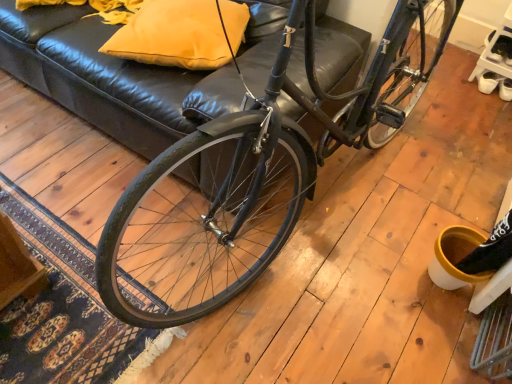
This screenshot has width=512, height=384. In order to click on matte yellow pillow at upper center in this screenshot , I will do `click(173, 35)`.

What do you see at coordinates (173, 35) in the screenshot?
I see `matte yellow pillow at upper center` at bounding box center [173, 35].

Measure the distance between point [129,39] and camera.

The distance of point [129,39] from camera is 1.48 meters.

What do you see at coordinates (251, 178) in the screenshot? The image size is (512, 384). I see `shiny black bicycle at center` at bounding box center [251, 178].

Consider the image. What is the approximate height of shiny black bicycle at center?

The height of shiny black bicycle at center is 1.17 meters.

The height and width of the screenshot is (384, 512). Identify the location of shiny black bicycle at center. click(x=251, y=178).

The height and width of the screenshot is (384, 512). I want to click on matte yellow pillow at upper center, so click(x=173, y=35).

In the scene shown: Which is more to the left, matte yellow pillow at upper center or shiny black bicycle at center?

Positioned to the left is matte yellow pillow at upper center.

Which object is further away from the camera taking this photo, matte yellow pillow at upper center or shiny black bicycle at center?

matte yellow pillow at upper center is more distant.

Between point (216, 64) and point (234, 279), which one is positioned behind?

Point (234, 279)

From the image's perspective, between matte yellow pillow at upper center and shiny black bicycle at center, which one is located above?

matte yellow pillow at upper center.

In the scene shown: From a real-world perspective, which is physically below, matte yellow pillow at upper center or shiny black bicycle at center?

matte yellow pillow at upper center.

Is matte yellow pillow at upper center wider or thinner than shiny black bicycle at center?

Considering their sizes, matte yellow pillow at upper center looks slimmer than shiny black bicycle at center.

Between matte yellow pillow at upper center and shiny black bicycle at center, which one has more height?

Standing taller between the two is shiny black bicycle at center.

Based on their sizes in the image, would you say matte yellow pillow at upper center is bigger or smaller than shiny black bicycle at center?

Clearly, matte yellow pillow at upper center is smaller in size than shiny black bicycle at center.

Choose the correct answer: Is matte yellow pillow at upper center inside shiny black bicycle at center or outside it?

The correct answer is: outside.

Is matte yellow pillow at upper center beside shiny black bicycle at center?

No, matte yellow pillow at upper center is not in contact with shiny black bicycle at center.

Is matte yellow pillow at upper center positioned with its back to shiny black bicycle at center?

No, shiny black bicycle at center is not at the back of matte yellow pillow at upper center.

Consider the image. Can you tell me how much matte yellow pillow at upper center and shiny black bicycle at center differ in facing direction?

There is a 32.4-degree angle between the facing directions of matte yellow pillow at upper center and shiny black bicycle at center.

This screenshot has height=384, width=512. What are the coordinates of `pillow that appears on the left of shiny black bicycle at center` in the screenshot? It's located at (173, 35).

Between shiny black bicycle at center and matte yellow pillow at upper center, which one appears on the left side from the viewer's perspective?

matte yellow pillow at upper center is more to the left.

From the picture: Considering the positions of objects shiny black bicycle at center and matte yellow pillow at upper center in the image provided, who is behind, shiny black bicycle at center or matte yellow pillow at upper center?

Positioned behind is matte yellow pillow at upper center.

Does point (381, 53) appear closer or farther from the camera than point (227, 29)?

Point (381, 53) appears to be farther away from the viewer than point (227, 29).

From the image's perspective, is shiny black bicycle at center over matte yellow pillow at upper center?

No, from the image's perspective, shiny black bicycle at center is not on top of matte yellow pillow at upper center.

From a real-world perspective, is shiny black bicycle at center positioned under matte yellow pillow at upper center based on gravity?

No, from a real-world perspective, shiny black bicycle at center is not under matte yellow pillow at upper center.

Looking at this image, is shiny black bicycle at center wider than matte yellow pillow at upper center?

Yes, shiny black bicycle at center is wider than matte yellow pillow at upper center.

Between shiny black bicycle at center and matte yellow pillow at upper center, which one has less height?

matte yellow pillow at upper center is shorter.

Does shiny black bicycle at center have a larger size compared to matte yellow pillow at upper center?

Yes, shiny black bicycle at center is bigger than matte yellow pillow at upper center.

Would you say shiny black bicycle at center is outside matte yellow pillow at upper center?

Yes, shiny black bicycle at center is not within matte yellow pillow at upper center.

From the picture: Would you say shiny black bicycle at center is a long distance from matte yellow pillow at upper center?

shiny black bicycle at center is actually quite close to matte yellow pillow at upper center.

Could you tell me if shiny black bicycle at center is turned towards matte yellow pillow at upper center?

No, shiny black bicycle at center is not turned towards matte yellow pillow at upper center.

How distant is shiny black bicycle at center from matte yellow pillow at upper center?

They are 20.69 inches apart.

You are a GUI agent. You are given a task and a screenshot of the screen. Output one action in this format:
    pyautogui.click(x=<x>, y=<y>)
    Task: Click on the bicycle below the matte yellow pillow at upper center (from the image's perspective)
    
    Given the screenshot: What is the action you would take?
    pyautogui.click(x=251, y=178)

Find the location of a particular element. This screenshot has width=512, height=384. bicycle in front of the matte yellow pillow at upper center is located at coordinates (251, 178).

This screenshot has height=384, width=512. What are the coordinates of `bicycle above the matte yellow pillow at upper center (from a real-world perspective)` in the screenshot? It's located at (251, 178).